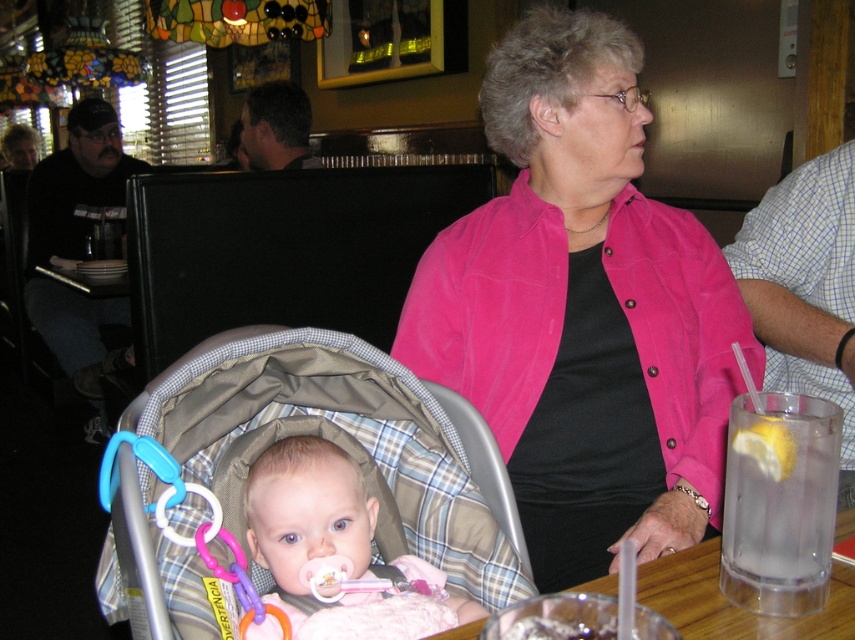
You are a photographer positioned at the center of the room. You want to take a photo of the plaid fabric baby carriage at center. According to the coordinates provided, where should you aim your camera to capture the baby carriage in the image?

The plaid fabric baby carriage at center is located at coordinates point (276, 440), so you should aim your camera towards that point to capture it.

You are a photographer adjusting your camera to focus on two points in the image. The first point is point (x=209, y=532) and the second is point (x=192, y=541). Which point is closer to you?

Point (x=209, y=532) is closer to you because it is further to the viewer than point (x=192, y=541).